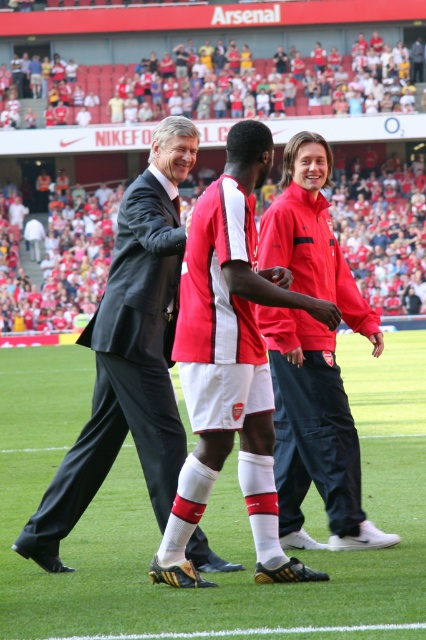
You are standing at point (290, 394) and want to walk to the Arsenal signage above the stands. Which direction should you move relative to point (238, 157)?

Since point (238, 157) is in front of point (290, 394), you should move towards point (238, 157) to reach the Arsenal signage above the stands.

You are a photographer at the stadium and need to capture a photo of both the red matte jersey at center and the red matte soccer jersey at center. Which one should you focus on first if you want to capture them in order from left to right?

The red matte jersey at center is on the right side of the red matte soccer jersey at center, so you should focus on the red matte soccer jersey at center first, followed by the red matte jersey at center to capture them from left to right.

You are a photographer standing on the sidelines of the football pitch. You want to take a photo of both the red matte jersey at center and the red matte soccer jersey at center. Which one will appear larger in your photo?

The red matte jersey at center will appear larger in the photo because it is closer to the photographer than the red matte soccer jersey at center.